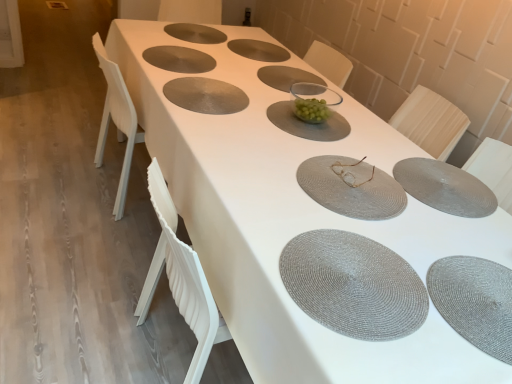
Locate an element on the screen. This screenshot has width=512, height=384. vacant space in matte gray placemat at center, the seventh tableware when ordered from top to bottom (from a real-world perspective) is located at coordinates coord(351,183).